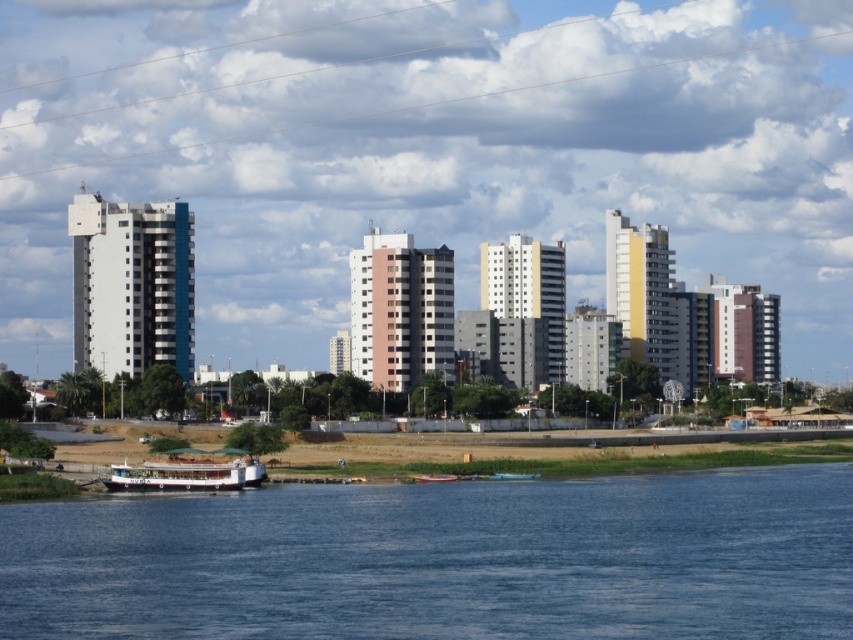
Who is lower down, white matte boat at lower center or metallic red boat at lower center?

Positioned lower is metallic red boat at lower center.

Who is more distant from viewer, (x=170, y=460) or (x=451, y=480)?

The point (x=451, y=480) is behind.

Does point (251, 483) lie behind point (421, 477)?

No, (251, 483) is in front of (421, 477).

I want to click on white matte boat at lower center, so click(x=189, y=472).

Identify the location of blue water at lower center. (444, 560).

Between point (540, 525) and point (119, 476), which one is positioned in front?

Point (540, 525) is in front.

Is point (415, 582) less distant than point (181, 461)?

Yes.

This screenshot has width=853, height=640. I want to click on blue water at lower center, so click(x=444, y=560).

Can you confirm if blue water at lower center is thinner than metallic red boat at lower center?

No.

Is blue water at lower center below metallic red boat at lower center?

No.

In order to click on blue water at lower center in this screenshot , I will do [444, 560].